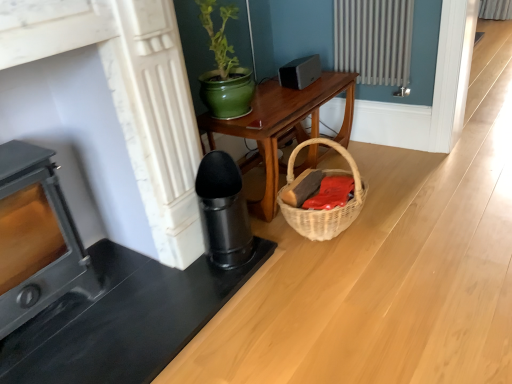
Question: Visually, is wooden table at center positioned to the left or to the right of metallic gray heater at left?

Choices:
 (A) left
 (B) right

Answer: (B)

Question: From the image's perspective, is wooden table at center above or below metallic gray heater at left?

Choices:
 (A) below
 (B) above

Answer: (B)

Question: Estimate the real-world distances between objects in this image. Which object is farther from the metallic gray heater at left?

Choices:
 (A) woven natural basket at center
 (B) satin black speaker at upper center
 (C) woven basket at lower right
 (D) wooden table at center

Answer: (B)

Question: Based on their relative distances, which object is farther from the wooden table at center?

Choices:
 (A) woven basket at lower right
 (B) satin black speaker at upper center
 (C) metallic gray heater at left
 (D) woven natural basket at center

Answer: (C)